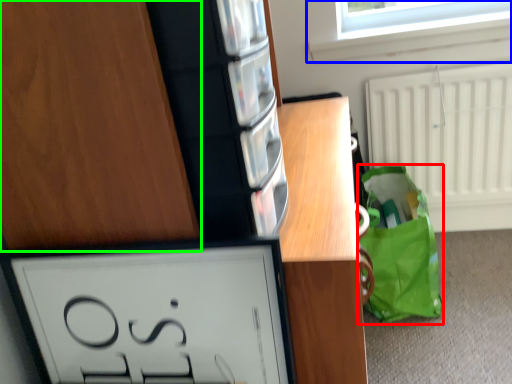
Question: Which is nearer to the tote bag (highlighted by a red box)? window (highlighted by a blue box) or cabinetry (highlighted by a green box).

Choices:
 (A) window
 (B) cabinetry

Answer: (A)